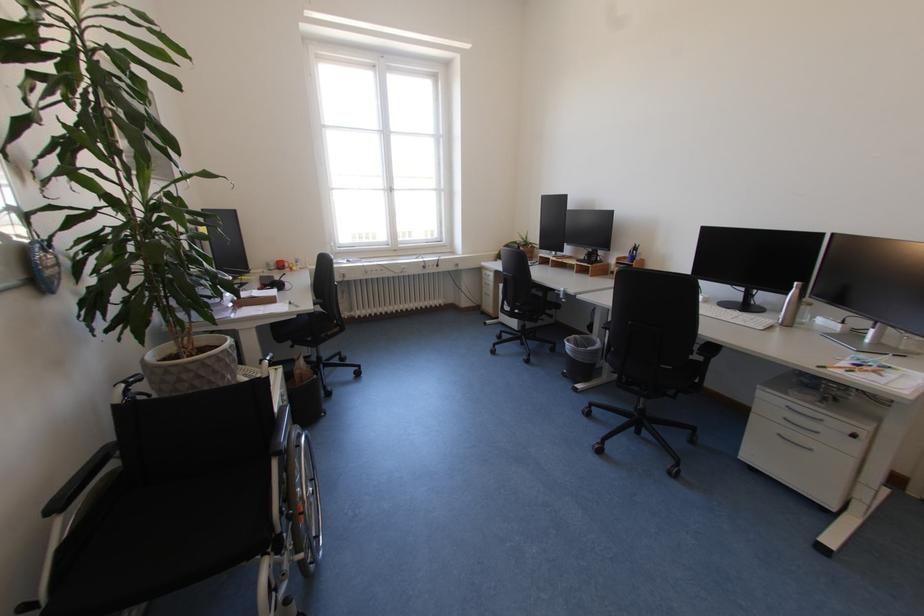
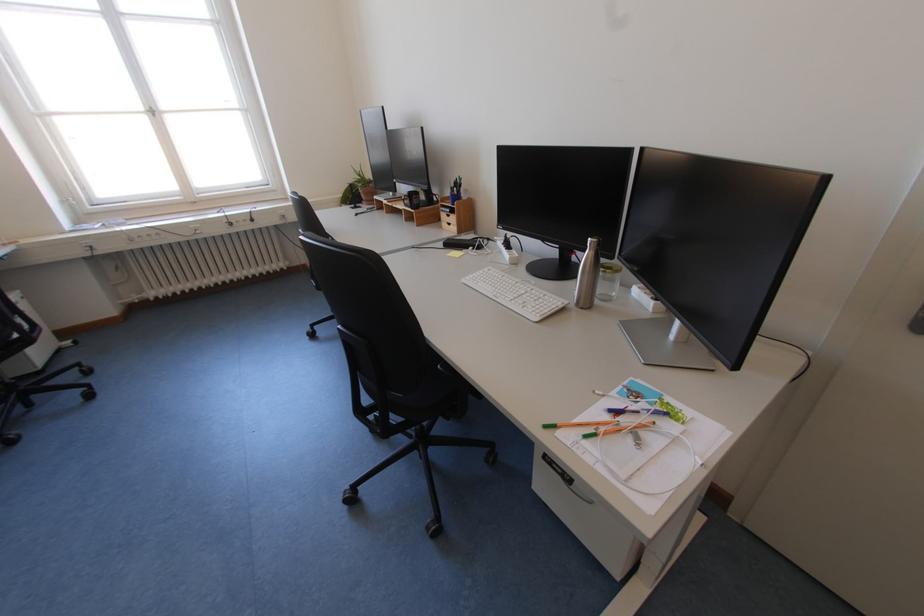
Which direction would the cameraman need to move to produce the second image?

The cameraman walked toward right, forward.